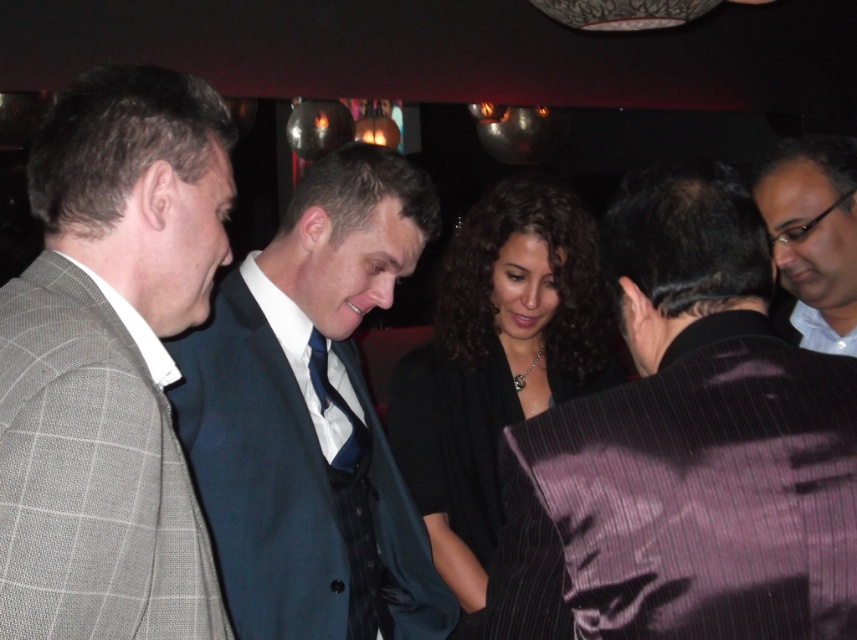
Does gray checkered suit at left have a greater width compared to blue satin tie at center?

Indeed, gray checkered suit at left has a greater width compared to blue satin tie at center.

The height and width of the screenshot is (640, 857). In order to click on gray checkered suit at left in this screenshot , I will do `click(111, 364)`.

How much distance is there between dark purple pinstripe suit at center and black silk dress at center?

A distance of 33.16 inches exists between dark purple pinstripe suit at center and black silk dress at center.

Who is more distant from viewer, (544, 444) or (423, 486)?

The point (423, 486) is more distant.

The image size is (857, 640). In order to click on dark purple pinstripe suit at center in this screenshot , I will do `click(685, 451)`.

I want to click on dark purple pinstripe suit at center, so click(685, 451).

Which of these two, dark blue suit at center or black silk dress at center, stands taller?

Standing taller between the two is dark blue suit at center.

Is dark blue suit at center wider than black silk dress at center?

Incorrect, dark blue suit at center's width does not surpass black silk dress at center's.

Is point (213, 481) positioned after point (546, 243)?

No, it is not.

Image resolution: width=857 pixels, height=640 pixels. I want to click on dark blue suit at center, so click(x=310, y=417).